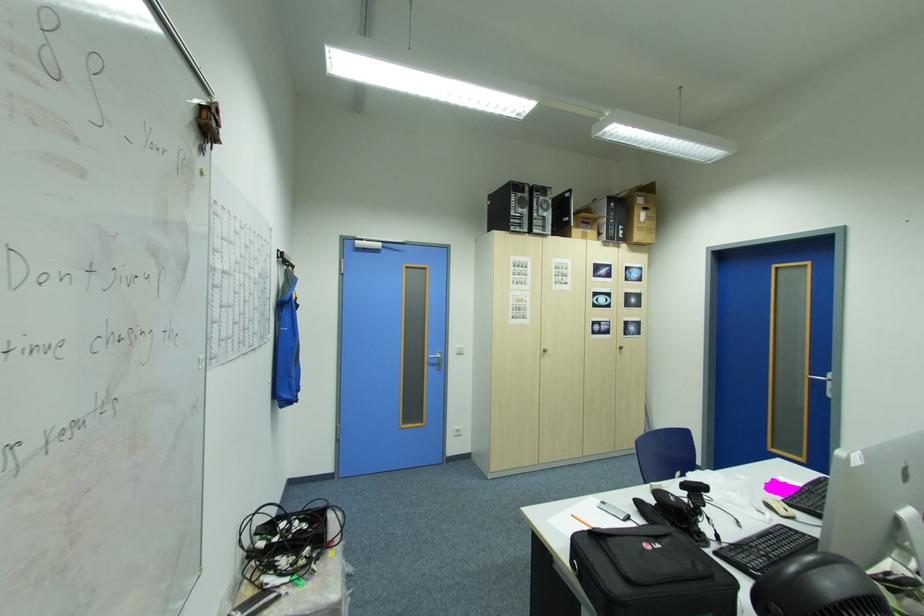
Find where to lift the orange pencil. Please return your answer as a coordinate pair (x, y).

(581, 521)